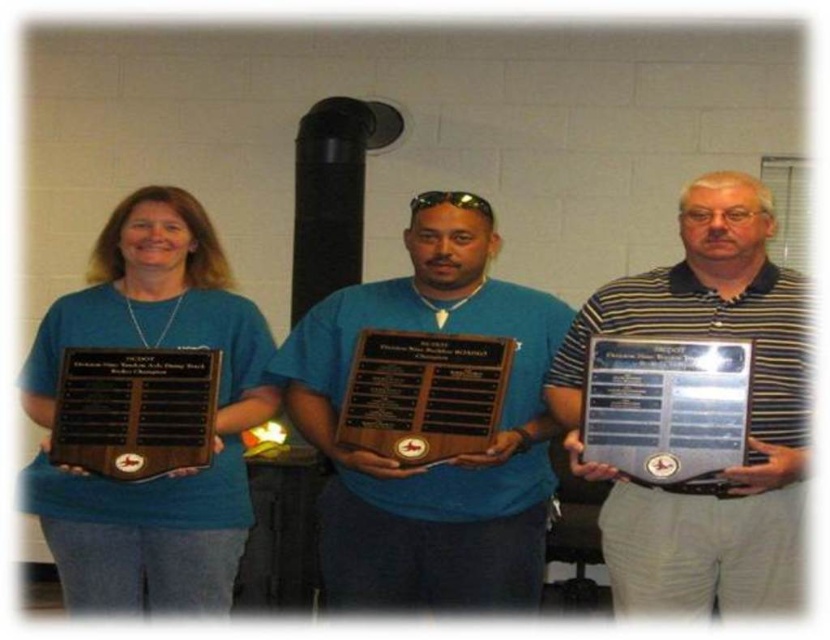
Question: Which object is the closest to the matte black plaque at left?

Choices:
 (A) wooden plaque at center
 (B) silver metallic plaque at center
 (C) matte wood plaque at center
 (D) metallic silver plaque at center

Answer: (C)

Question: Is metallic silver plaque at center to the left of black polished wood plaque at left from the viewer's perspective?

Choices:
 (A) yes
 (B) no

Answer: (B)

Question: Does metallic silver plaque at center appear on the left side of wooden plaque at center?

Choices:
 (A) yes
 (B) no

Answer: (B)

Question: Which of the following is the farthest from the observer?

Choices:
 (A) (54, 452)
 (B) (726, 369)
 (C) (726, 472)
 (D) (481, 266)

Answer: (D)

Question: Considering the real-world distances, which object is farthest from the matte wood plaque at center?

Choices:
 (A) matte black plaque at left
 (B) silver metallic plaque at center

Answer: (A)

Question: Can you confirm if black polished wood plaque at left is positioned to the left of wooden plaque at center?

Choices:
 (A) yes
 (B) no

Answer: (A)